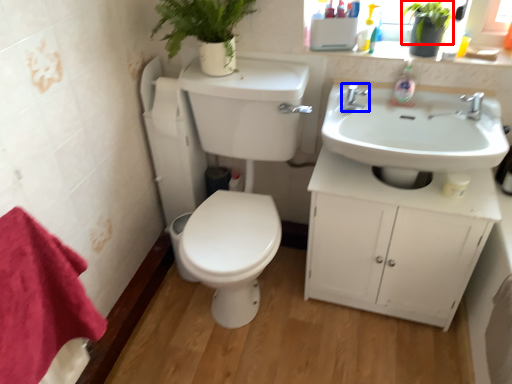
Question: Which object is closer to the camera taking this photo, plant (highlighted by a red box) or tap (highlighted by a blue box)?

Choices:
 (A) plant
 (B) tap

Answer: (A)